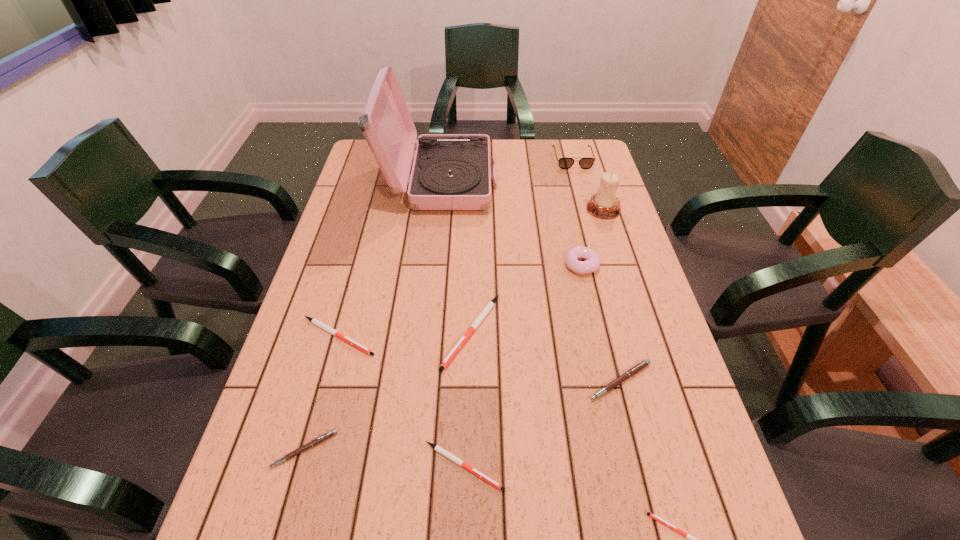
Where is `vacant point located on the clicker of the third smallest white pen`? The width and height of the screenshot is (960, 540). vacant point located on the clicker of the third smallest white pen is located at coordinates (407, 336).

Find the location of `blank space located at the nib of the smaller pink pen`. blank space located at the nib of the smaller pink pen is located at coordinates (283, 526).

Image resolution: width=960 pixels, height=540 pixels. What are the coordinates of `vacant area located 0.060m on the clicker of the second nearest white pen` in the screenshot? It's located at (535, 466).

This screenshot has width=960, height=540. In order to click on record player located in the far edge section of the desktop in this screenshot , I will do `click(450, 171)`.

Find the location of a particular element. The width and height of the screenshot is (960, 540). spectacles that is at the far edge is located at coordinates (564, 163).

Where is `record player at the left edge`? The image size is (960, 540). record player at the left edge is located at coordinates (450, 171).

Image resolution: width=960 pixels, height=540 pixels. Identify the location of candle holder located at the right edge. (604, 204).

You are a GUI agent. You are given a task and a screenshot of the screen. Output one action in this format:
    pyautogui.click(x=<x>, y=<y>)
    Task: Click on the spectacles located at the right edge
    
    Given the screenshot: What is the action you would take?
    pyautogui.click(x=564, y=163)

Locate an element on the screen. The width and height of the screenshot is (960, 540). doughnut situated at the right edge is located at coordinates (592, 263).

This screenshot has height=540, width=960. What are the coordinates of `pen present at the right edge` in the screenshot? It's located at (637, 368).